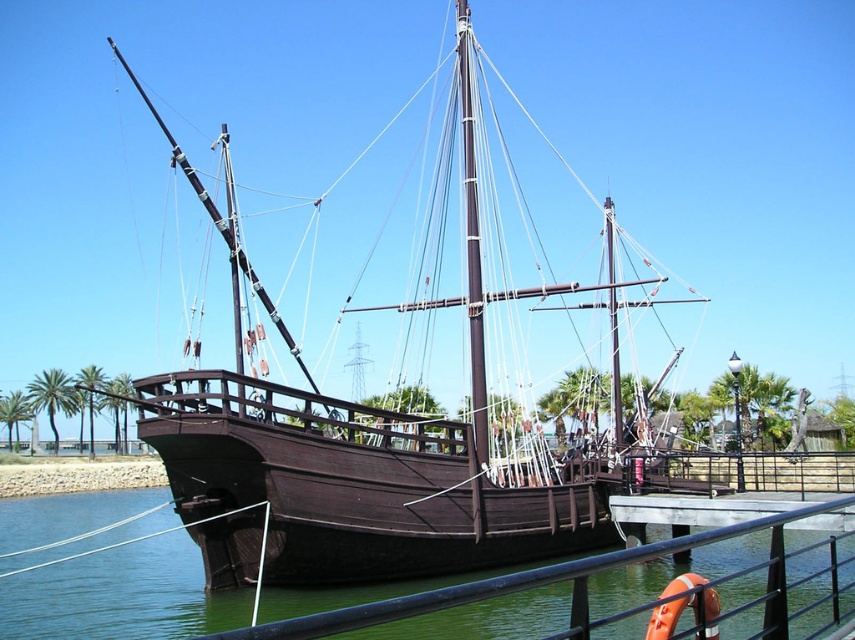
Between dark brown wooden pirate ship at center and black metal/rail at lower center, which one has less height?

black metal/rail at lower center is shorter.

Is point (258, 528) behind point (799, 513)?

That is True.

Identify the location of dark brown wooden pirate ship at center. (358, 467).